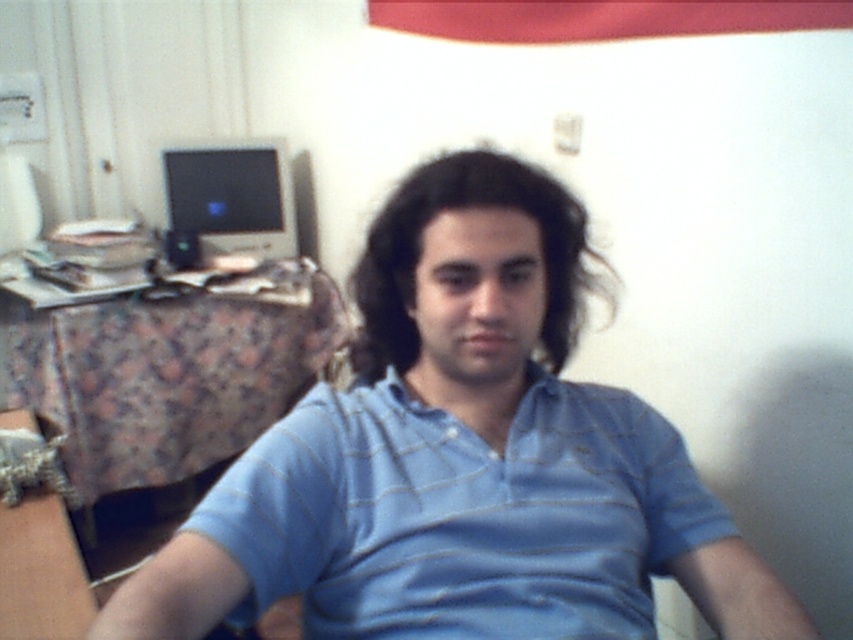
You are an interior designer assessing the layout of this room. The blue striped polo shirt at center and the matte black monitor at upper left are both in view. Which object is positioned lower in the room?

The blue striped polo shirt at center is positioned below the matte black monitor at upper left, so the blue striped polo shirt at center is lower in the room.

You are a tailor measuring a person for a custom shirt. You notice the blue striped shirt at center and the blue striped polo shirt at center. Which one is closer to the red banner at the top edge?

The blue striped polo shirt at center is closer to the red banner at the top edge because the distance between the blue striped shirt at center and the blue striped polo shirt at center is 1.48 inches, implying they are the same item with different names.